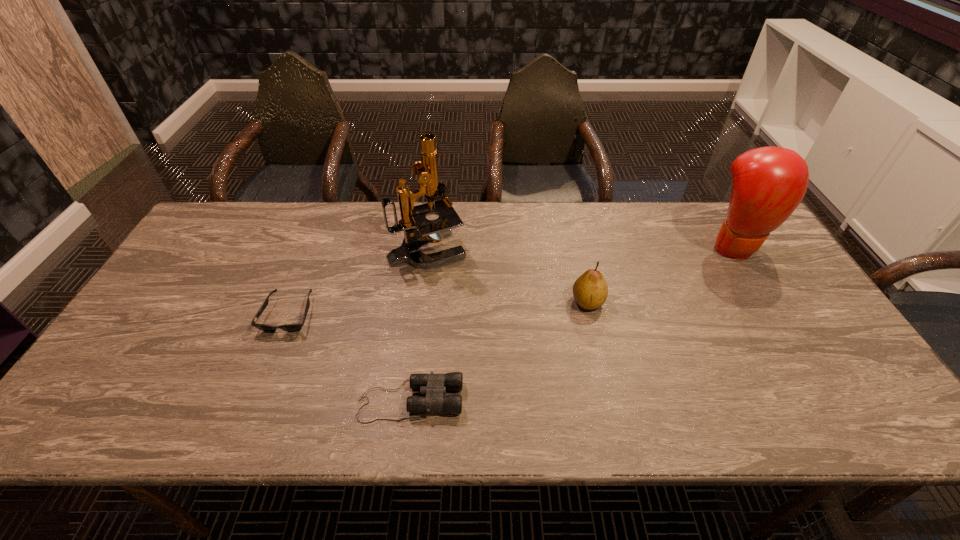
Locate an element on the screen. The width and height of the screenshot is (960, 540). free region at the right edge of the desktop is located at coordinates (770, 294).

Where is `vacant space at the near left corner of the desktop`? The height and width of the screenshot is (540, 960). vacant space at the near left corner of the desktop is located at coordinates (108, 433).

Where is `free spot between the leftmost object and the fourth object from left to right`? This screenshot has width=960, height=540. free spot between the leftmost object and the fourth object from left to right is located at coordinates (439, 308).

Locate an element on the screen. This screenshot has width=960, height=540. vacant space in between the nearest object and the microscope is located at coordinates (419, 325).

The image size is (960, 540). Identify the location of empty space between the fourth object from left to right and the leftmost object. (439, 308).

You are a GUI agent. You are given a task and a screenshot of the screen. Output one action in this format:
    pyautogui.click(x=<x>, y=<y>)
    Task: Click on the empty space between the nearest object and the fourth object from left to right
    This screenshot has height=540, width=960.
    Given the screenshot: What is the action you would take?
    pyautogui.click(x=499, y=351)

The height and width of the screenshot is (540, 960). In order to click on blank region between the rightmost object and the microscope in this screenshot , I will do `click(581, 247)`.

This screenshot has height=540, width=960. Find the location of `vacant space that is in between the boxing glove and the second object from right to left`. vacant space that is in between the boxing glove and the second object from right to left is located at coordinates point(661,274).

The image size is (960, 540). In order to click on unoccupied position between the sunglasses and the microscope in this screenshot , I will do `click(358, 281)`.

I want to click on free spot between the leftmost object and the third shortest object, so pyautogui.click(x=439, y=308).